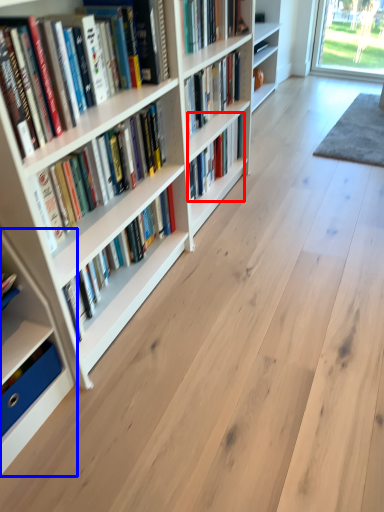
Question: Which object appears closest to the camera in this image, book (highlighted by a red box) or shelf (highlighted by a blue box)?

Choices:
 (A) book
 (B) shelf

Answer: (B)